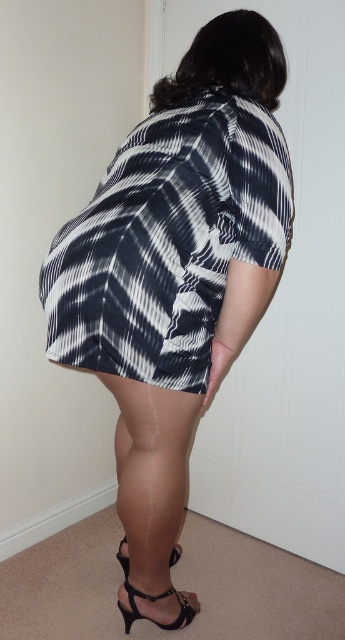
You are a photographer setting up a shoot in the room described. You need to place a 12.38 inch wide prop between the two black leather sandals. Is there enough space between the black leather sandal at lower right and the black leather sandal at lower center to fit the prop?

The distance between the black leather sandal at lower right and the black leather sandal at lower center is 6.19 inches. Since the prop is 12.38 inches wide, which is double the distance between the sandals, there is not enough space to fit the prop between them.

In the scene shown: You are a photographer setting up for a photoshoot. You need to position a spotlight so it illuminates both the printed fabric dress at center and the black leather sandal at lower right equally. Given their positions, which object should you place the spotlight closer to?

The printed fabric dress at center is closer to the viewer than the black leather sandal at lower right. To ensure both receive equal illumination, the spotlight should be placed closer to the black leather sandal at lower right since it is farther away and requires more light to achieve the same brightness.